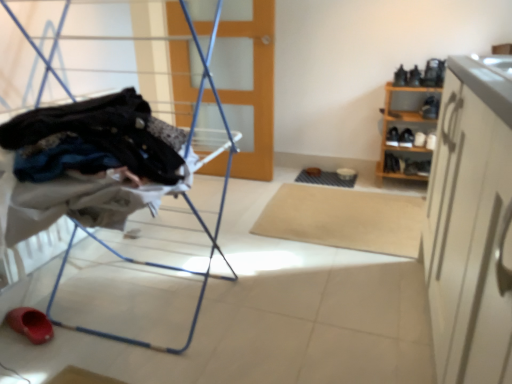
Question: Does wooden shoe rack at right turn towards metal laundry rack at left?

Choices:
 (A) yes
 (B) no

Answer: (B)

Question: Can you confirm if wooden shoe rack at right is positioned to the left of metal laundry rack at left?

Choices:
 (A) no
 (B) yes

Answer: (A)

Question: Is wooden shoe rack at right positioned behind metal laundry rack at left?

Choices:
 (A) no
 (B) yes

Answer: (B)

Question: Can you confirm if wooden shoe rack at right is thinner than metal laundry rack at left?

Choices:
 (A) yes
 (B) no

Answer: (A)

Question: Does wooden shoe rack at right have a greater height compared to metal laundry rack at left?

Choices:
 (A) no
 (B) yes

Answer: (A)

Question: In terms of height, does wooden shoe rack at right look taller or shorter compared to metal laundry rack at left?

Choices:
 (A) short
 (B) tall

Answer: (A)

Question: Considering the positions of point (385, 122) and point (218, 244), is point (385, 122) closer or farther from the camera than point (218, 244)?

Choices:
 (A) closer
 (B) farther

Answer: (B)

Question: Looking at their shapes, would you say wooden shoe rack at right is wider or thinner than metal laundry rack at left?

Choices:
 (A) wide
 (B) thin

Answer: (B)

Question: Is wooden shoe rack at right situated inside metal laundry rack at left or outside?

Choices:
 (A) outside
 (B) inside

Answer: (A)

Question: Is metal laundry rack at left inside the boundaries of wooden at center, or outside?

Choices:
 (A) outside
 (B) inside

Answer: (A)

Question: In terms of size, does metal laundry rack at left appear bigger or smaller than wooden at center?

Choices:
 (A) small
 (B) big

Answer: (B)

Question: Relative to wooden at center, is metal laundry rack at left in front or behind?

Choices:
 (A) behind
 (B) front

Answer: (B)

Question: Is metal laundry rack at left wider or thinner than wooden at center?

Choices:
 (A) wide
 (B) thin

Answer: (A)

Question: Choose the correct answer: Is metal laundry rack at left inside rubber/soft sole shoe at lower left or outside it?

Choices:
 (A) inside
 (B) outside

Answer: (B)

Question: Is point (68, 178) closer or farther from the camera than point (18, 314)?

Choices:
 (A) farther
 (B) closer

Answer: (B)